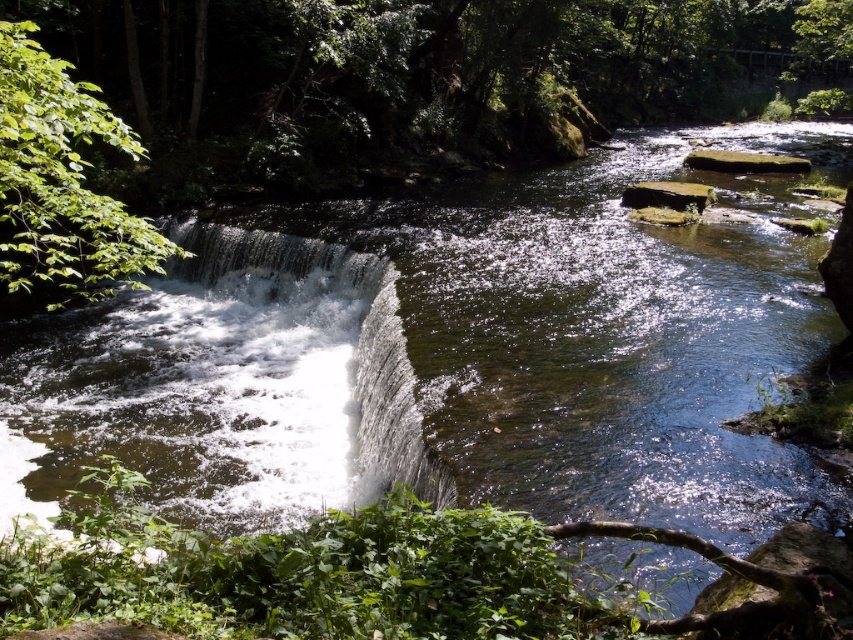
Based on the photo, you are a hiker carrying a 2.5 meter long ladder. You need to cross the river but there is a green leafy tree at left blocking your path. Can you use the ladder to reach the white frothy water at center from the tree?

The distance between the white frothy water at center and the green leafy tree at left is 3.07 meters. Since the ladder is 2.5 meters long, it is shorter than the required distance. Therefore, you cannot use the ladder to reach the white frothy water at center from the green leafy tree at left.